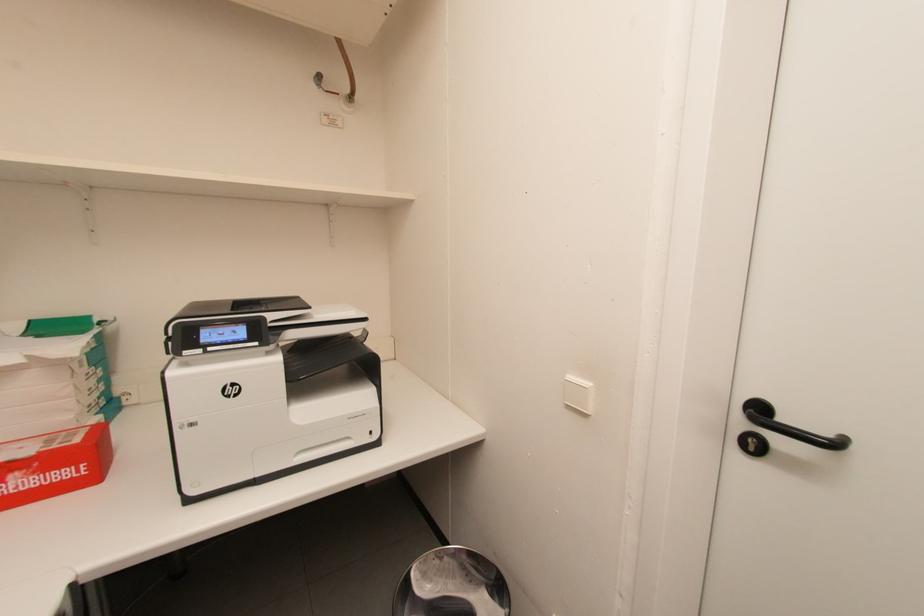
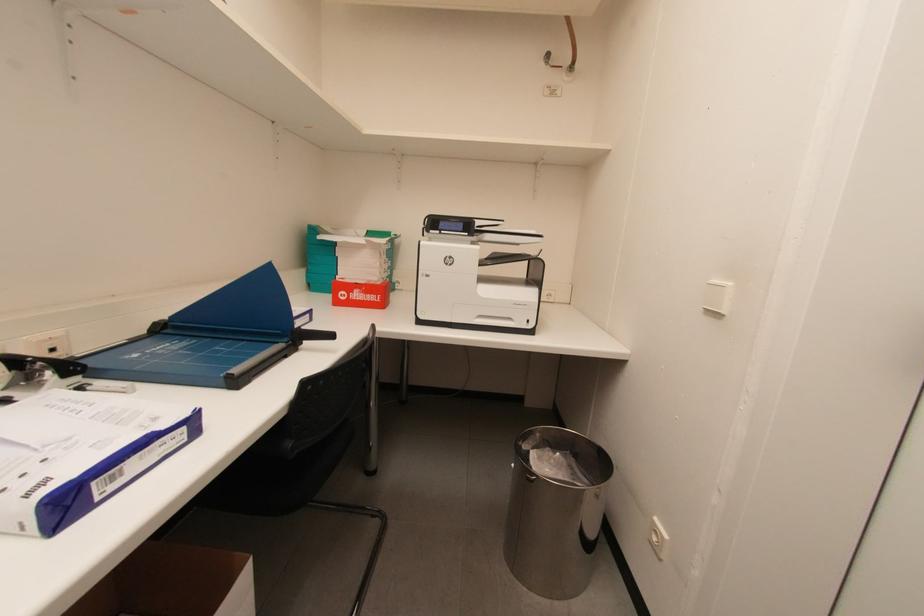
Question: How did the camera likely rotate?

Choices:
 (A) Left
 (B) Right
 (C) Up
 (D) Down

Answer: (A)